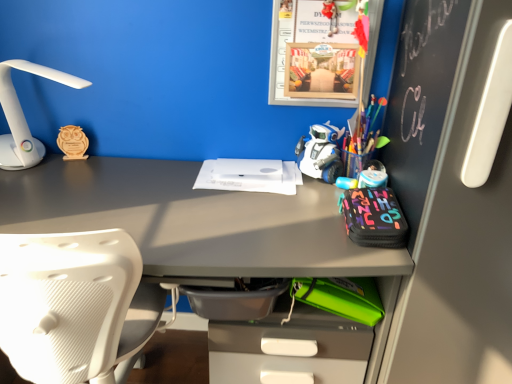
Find the location of `free space to the left of white plastic robot at center`. free space to the left of white plastic robot at center is located at coordinates (267, 182).